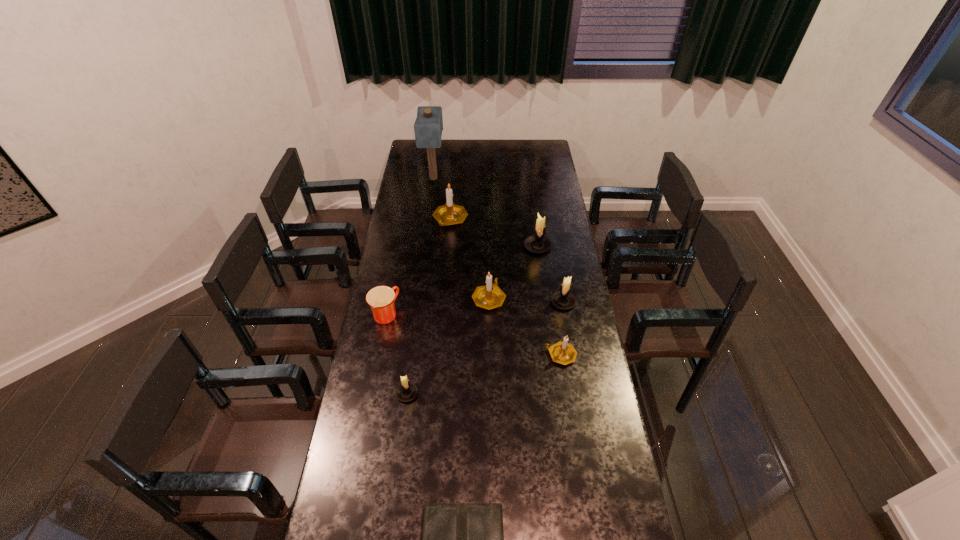
This screenshot has width=960, height=540. Find the location of `the second nearest object`. the second nearest object is located at coordinates (407, 391).

At what (x,y) coordinates should I click in order to perform the action: click on the rightmost gold candle holder. Please return your answer as a coordinate pair (x, y). The height and width of the screenshot is (540, 960). Looking at the image, I should click on (562, 352).

Find the location of `the fifth farthest candle holder`. the fifth farthest candle holder is located at coordinates (562, 352).

This screenshot has height=540, width=960. Identify the location of the leftmost object. (381, 299).

This screenshot has height=540, width=960. I want to click on free space located 0.400m on the front of the mallet, so click(x=426, y=237).

Locate an element on the screen. This screenshot has height=540, width=960. blank space located 0.160m on the front of the second farthest object is located at coordinates (447, 254).

You are a GUI agent. You are given a task and a screenshot of the screen. Output one action in this format:
    pyautogui.click(x=<x>, y=<y>)
    Task: Click on the vacant region located on the back of the seventh nearest object
    
    Given the screenshot: What is the action you would take?
    532,205

What are the coordinates of `free space located 0.120m on the back of the second biggest gold candle holder` in the screenshot? It's located at (489, 265).

I want to click on free space located 0.190m on the front of the second nearest white candle holder, so click(571, 350).

Where is `vacant space located 0.170m on the right of the second nearest object`? This screenshot has height=540, width=960. vacant space located 0.170m on the right of the second nearest object is located at coordinates (466, 393).